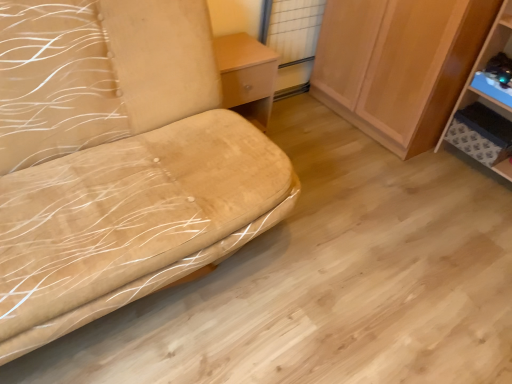
The width and height of the screenshot is (512, 384). What are the coordinates of `vacant area located to the right-hand side of light wood/texture table at center` in the screenshot? It's located at (289, 137).